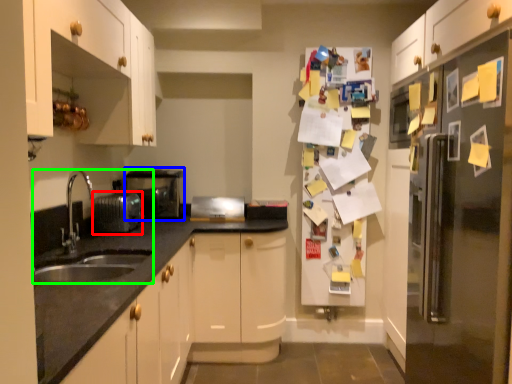
Question: Considering the real-world distances, which object is farthest from appliance (highlighted by a red box)? appliance (highlighted by a blue box) or sink (highlighted by a green box)?

Choices:
 (A) appliance
 (B) sink

Answer: (A)